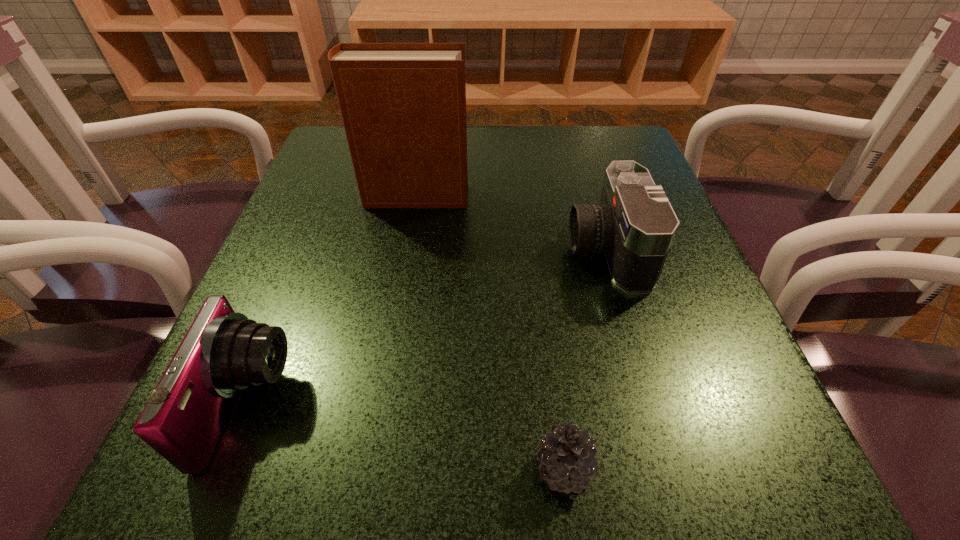
What are the coordinates of `vacant region at the far edge` in the screenshot? It's located at (554, 154).

Identify the location of vacant space at the near edge of the desktop. The height and width of the screenshot is (540, 960). (332, 436).

What are the coordinates of `vacant space at the left edge of the desktop` in the screenshot? It's located at (311, 247).

Where is `vacant space at the right edge`? vacant space at the right edge is located at coordinates pos(645,404).

Identify the location of free point at the far left corner. (338, 131).

The image size is (960, 540). Identify the location of free space at the near right corner of the desktop. (655, 447).

This screenshot has height=540, width=960. Identify the location of blank region between the third object from right to left and the leftmost object. (331, 301).

This screenshot has height=540, width=960. In order to click on vacant area between the leftmost object and the farthest object in this screenshot , I will do `click(331, 301)`.

The width and height of the screenshot is (960, 540). I want to click on vacant region between the leftmost object and the third nearest object, so click(427, 327).

Where is `empty space that is in between the leftmost object and the farthest object`? empty space that is in between the leftmost object and the farthest object is located at coordinates (331, 301).